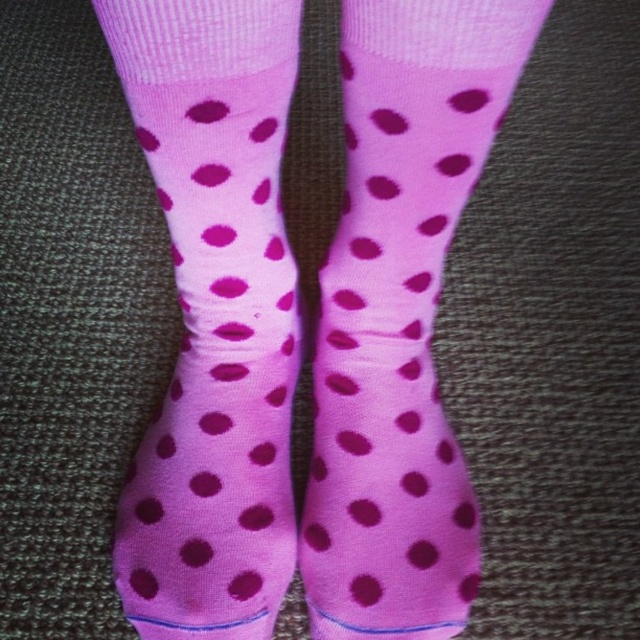
Question: Can you confirm if pink dotted sock at center is positioned above pink matte socks at center?

Choices:
 (A) yes
 (B) no

Answer: (A)

Question: Which of the following is the closest to the observer?

Choices:
 (A) (161, 452)
 (B) (432, 532)

Answer: (B)

Question: Does pink dotted sock at center appear over pink matte socks at center?

Choices:
 (A) yes
 (B) no

Answer: (A)

Question: Observing the image, what is the correct spatial positioning of pink dotted sock at center in reference to pink matte socks at center?

Choices:
 (A) below
 (B) above

Answer: (B)

Question: Among these points, which one is farthest from the camera?

Choices:
 (A) click(x=440, y=104)
 (B) click(x=188, y=102)

Answer: (A)